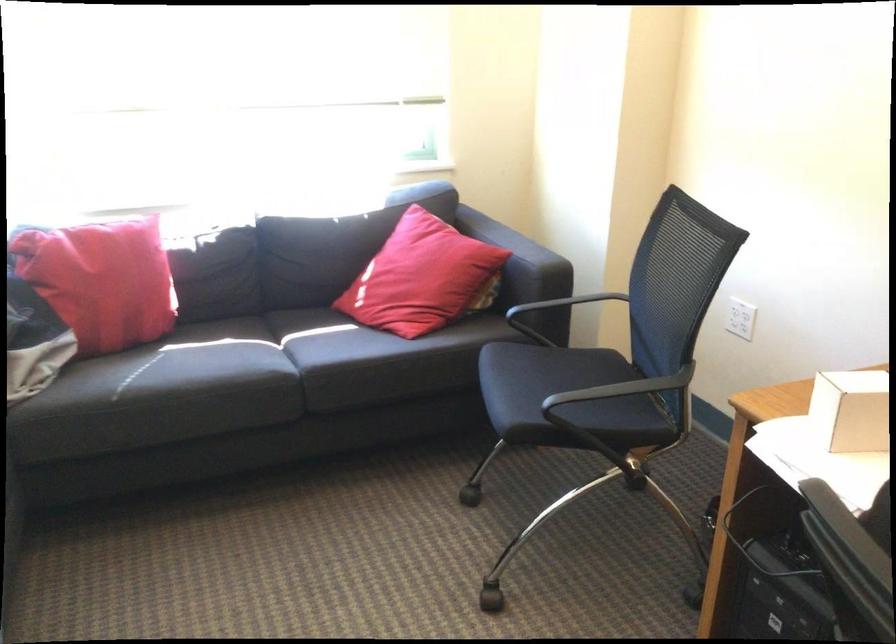
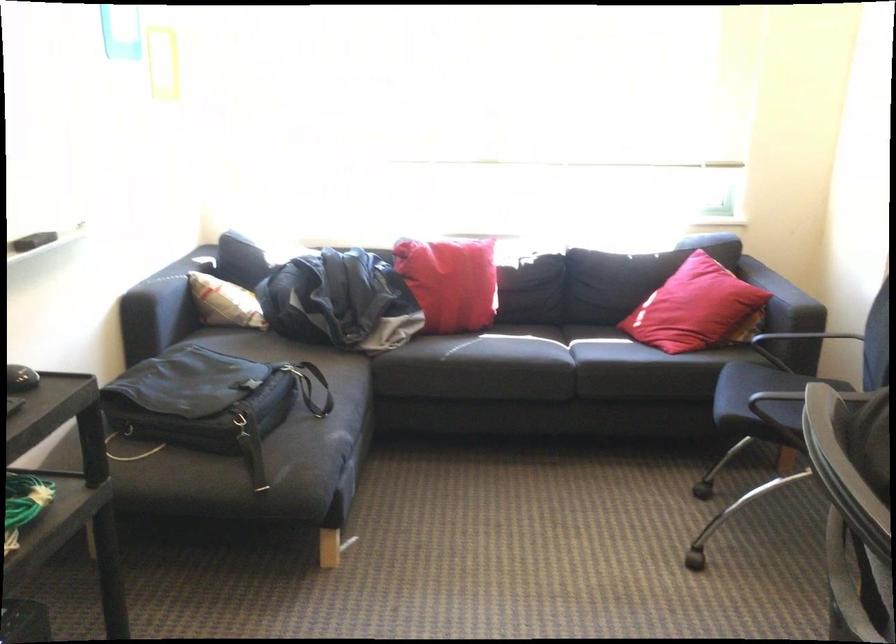
Find the pixel in the second image that matches (104,290) in the first image.

(450, 281)